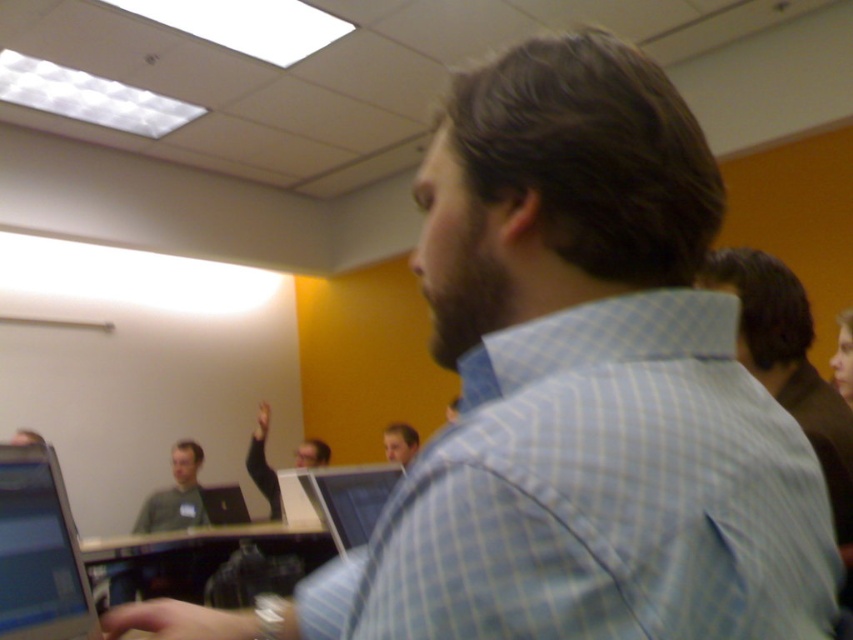
You are standing in the classroom and want to reach the point marked at coordinates point (270, 492). If your walking distance is limited to 12 feet, will you be able to reach it without moving further away?

The point (270, 492) is 13.24 feet away from the viewer, which exceeds the 12 feet walking distance limit. Therefore, you cannot reach it without moving further away.

You are sitting at a table in the classroom and need to reach both the shiny black laptop at left and the matte black laptop at center. Which one is closer to your right hand?

The matte black laptop at center is closer to your right hand because the shiny black laptop at left is positioned on the left side of it, meaning the matte black laptop at center is to the right of the shiny black laptop at left.